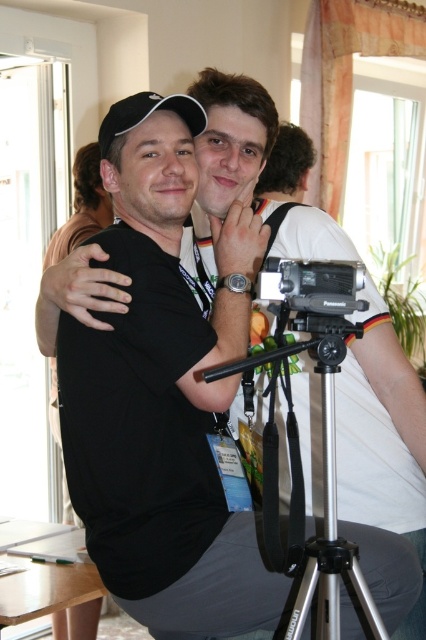
Measure the distance between silver metallic tripod at center and black plastic camera at center.

The distance of silver metallic tripod at center from black plastic camera at center is 6.20 inches.

Does silver metallic tripod at center have a smaller size compared to black plastic camera at center?

No, silver metallic tripod at center is not smaller than black plastic camera at center.

The height and width of the screenshot is (640, 426). I want to click on silver metallic tripod at center, so click(322, 477).

Where is `silver metallic tripod at center`? silver metallic tripod at center is located at coordinates (322, 477).

Does point (330, 426) come closer to viewer compared to point (178, 100)?

Yes, point (330, 426) is in front of point (178, 100).

Does silver metallic tripod at center have a greater width compared to black matte baseball cap at upper left?

Yes, silver metallic tripod at center is wider than black matte baseball cap at upper left.

This screenshot has height=640, width=426. I want to click on silver metallic tripod at center, so click(x=322, y=477).

How much distance is there between black plastic camera at center and black matte baseball cap at upper left?

black plastic camera at center is 53.71 centimeters from black matte baseball cap at upper left.

Does point (279, 260) come closer to viewer compared to point (103, 125)?

Yes, point (279, 260) is closer to viewer.

The width and height of the screenshot is (426, 640). I want to click on black plastic camera at center, so click(311, 285).